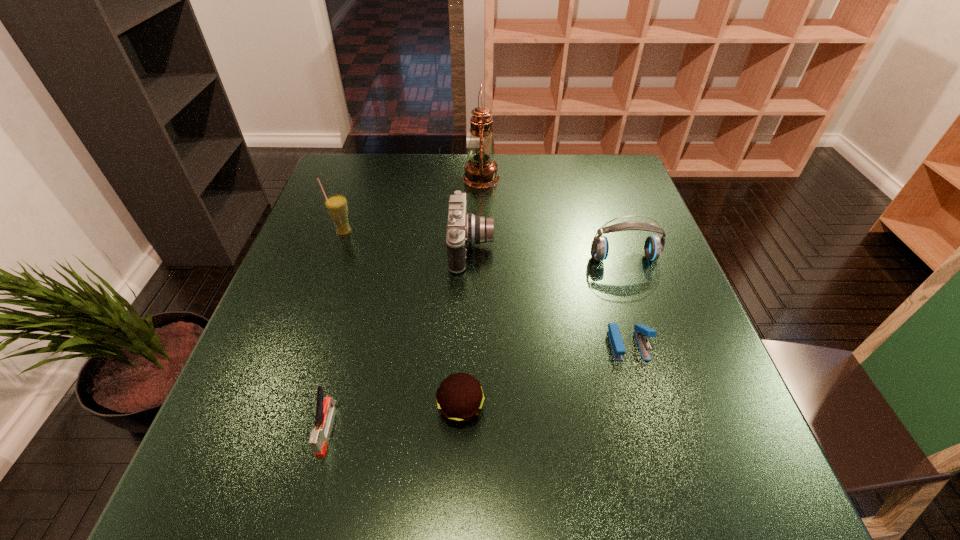
Where is `the tallest object`? The width and height of the screenshot is (960, 540). the tallest object is located at coordinates (481, 171).

Where is `oil lamp`? The image size is (960, 540). oil lamp is located at coordinates (481, 171).

Where is `the second tallest object`? Image resolution: width=960 pixels, height=540 pixels. the second tallest object is located at coordinates (336, 205).

Locate an element on the screen. This screenshot has height=540, width=960. the leftmost object is located at coordinates (336, 205).

The image size is (960, 540). I want to click on camera, so click(x=463, y=229).

You are a GUI agent. You are given a task and a screenshot of the screen. Output one action in this format:
    pyautogui.click(x=<x>, y=<y>)
    Task: Click on the headset
    The height and width of the screenshot is (540, 960).
    Given the screenshot: What is the action you would take?
    pyautogui.click(x=653, y=248)

I want to click on the left stapler, so click(325, 409).

This screenshot has height=540, width=960. Find the location of `the sixth object from right to left`. the sixth object from right to left is located at coordinates (325, 409).

Find the location of `patty`. patty is located at coordinates (460, 397).

Where is `the third nearest object`? Image resolution: width=960 pixels, height=540 pixels. the third nearest object is located at coordinates (640, 330).